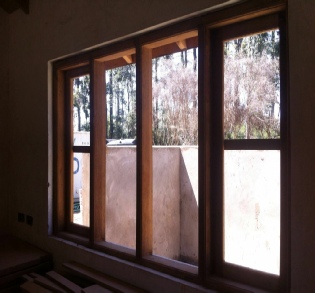
Image resolution: width=315 pixels, height=293 pixels. I want to click on wall, so click(20, 118), click(306, 132).